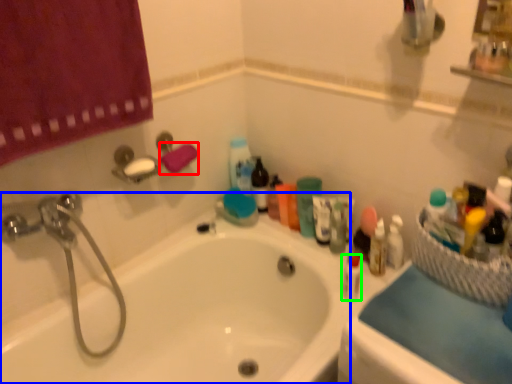
Question: Based on their relative distances, which object is nearer to bath towel (highlighted by a red box)? Choose from bathtub (highlighted by a blue box) and mouthwash (highlighted by a green box).

Choices:
 (A) bathtub
 (B) mouthwash

Answer: (A)